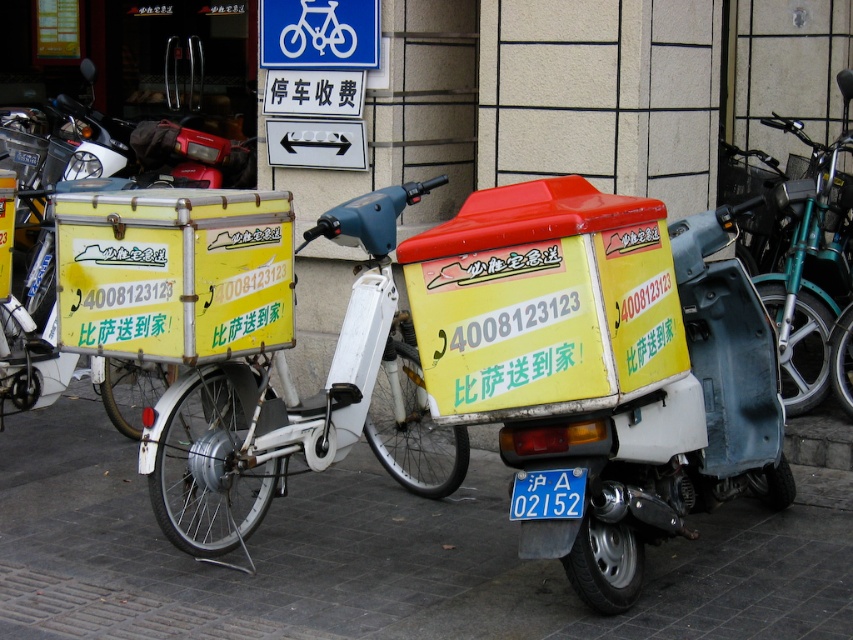
You are a delivery person who needs to place a new license plate on the gray concrete pavement at lower center. However, there is already a blue metallic license plate at center. Where should you position the new license plate so it doesn not overlap with the existing one?

The gray concrete pavement at lower center is to the left of the blue metallic license plate at center, so placing the new license plate to the right of the existing blue metallic license plate at center would prevent overlap.

You are standing in front of the two delivery scooters and want to take a photo. There are two points marked in the image. Point A is at coordinates point (849, 176) and Point B is at coordinates point (584, 481). Which point will appear closer to the top edge of your photo?

Point A at coordinates point (849, 176) is further to the camera than point B at coordinates point (584, 481). Since Point A is closer to the camera, it will appear closer to the top edge of the photo.